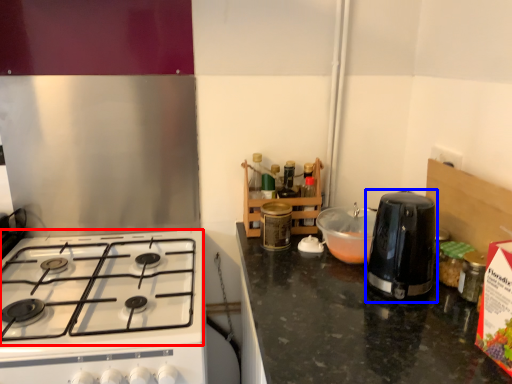
Question: Which object is further to the camera taking this photo, gas stove (highlighted by a red box) or kitchen appliance (highlighted by a blue box)?

Choices:
 (A) gas stove
 (B) kitchen appliance

Answer: (B)